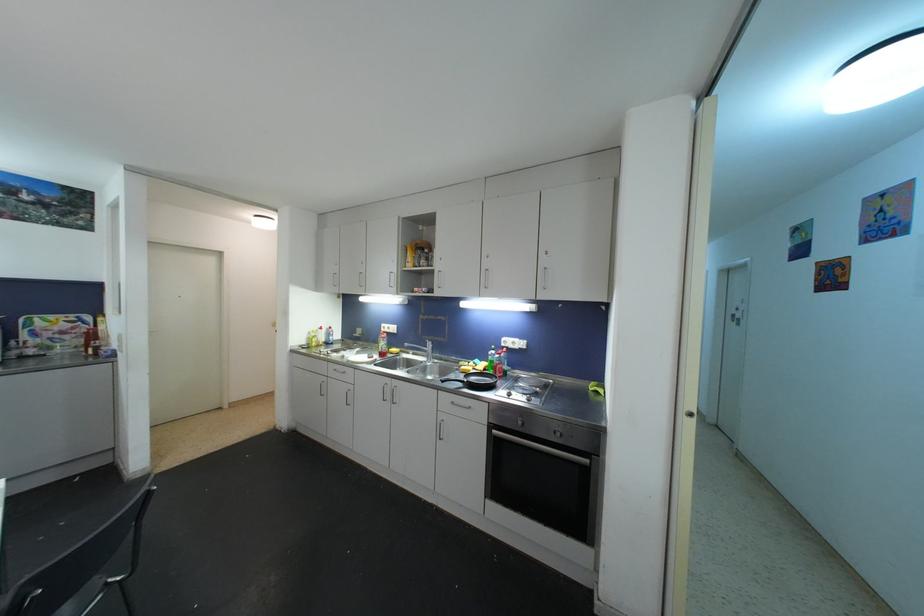
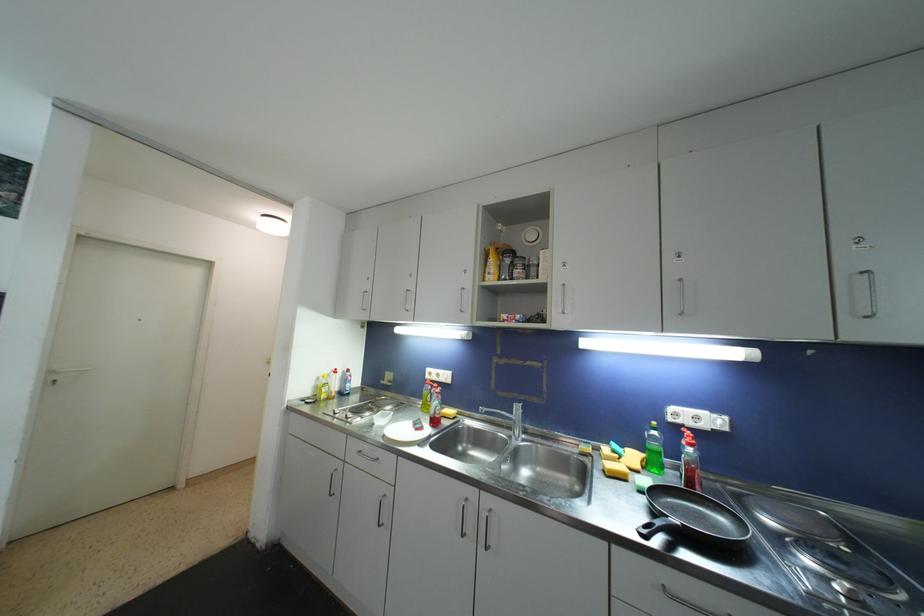
Locate, in the second image, the point that corresponds to (495,354) in the first image.

(658, 436)